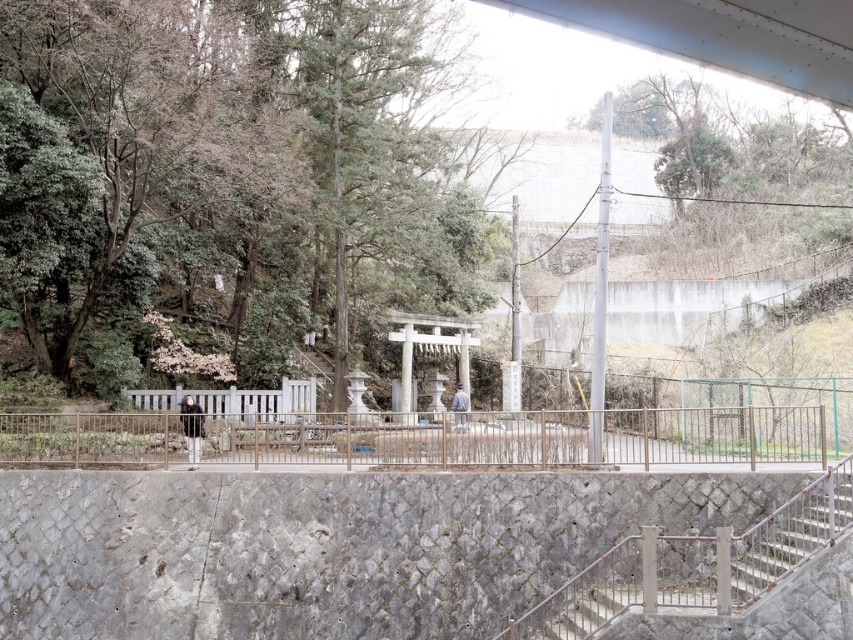
Question: Which object appears farthest from the camera in this image?

Choices:
 (A) gray stone stairs at lower right
 (B) green leafy tree at center
 (C) gold metallic fence at center

Answer: (B)

Question: Is gray stone stairs at lower right further to camera compared to metallic gray staircase at lower right?

Choices:
 (A) no
 (B) yes

Answer: (A)

Question: Which point is closer to the camera taking this photo?

Choices:
 (A) click(630, 445)
 (B) click(57, 349)

Answer: (A)

Question: Which object is farther from the camera taking this photo?

Choices:
 (A) gray stone stairs at lower right
 (B) green leafy tree at center

Answer: (B)

Question: Is gold metallic fence at center behind gray stone stairs at lower right?

Choices:
 (A) yes
 (B) no

Answer: (A)

Question: Is green leafy tree at center bigger than metallic gray staircase at lower right?

Choices:
 (A) no
 (B) yes

Answer: (B)